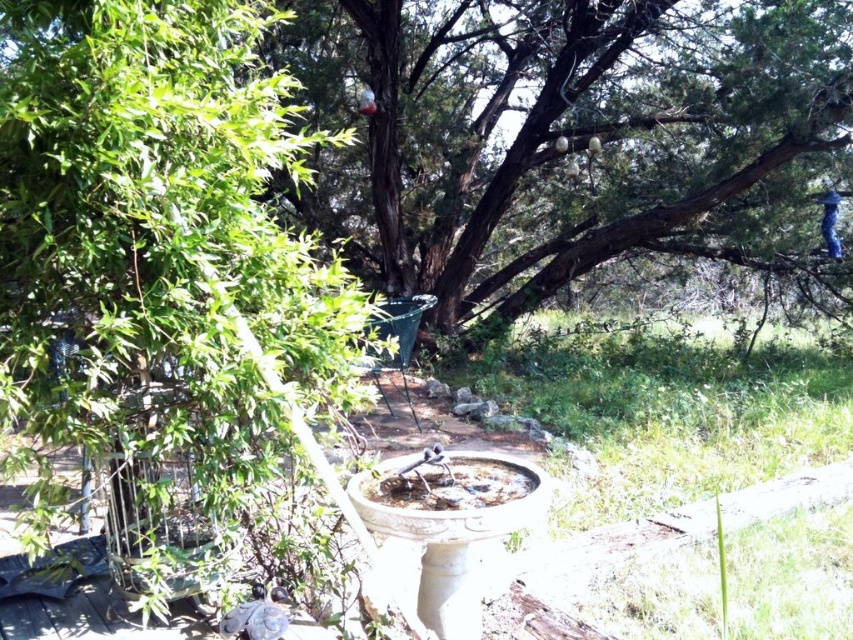
Between green leafy tree at upper left and white ceramic bird bath at center, which one appears on the right side from the viewer's perspective?

From the viewer's perspective, white ceramic bird bath at center appears more on the right side.

Who is higher up, green leafy tree at upper left or white ceramic bird bath at center?

Positioned higher is green leafy tree at upper left.

Between point (105, 35) and point (433, 541), which one is positioned behind?

Point (433, 541)

This screenshot has height=640, width=853. Identify the location of green leafy tree at upper left. (160, 237).

Can you confirm if blue matte parrot at upper right is positioned to the right of red matte bird at upper center?

Correct, you'll find blue matte parrot at upper right to the right of red matte bird at upper center.

Can you confirm if blue matte parrot at upper right is smaller than red matte bird at upper center?

No.

Is point (833, 248) positioned after point (372, 93)?

That is True.

The image size is (853, 640). Identify the location of blue matte parrot at upper right. (830, 221).

Which is in front, point (456, 3) or point (222, 621)?

Point (222, 621) is in front.

Locate an element on the screen. The image size is (853, 640). green textured tree at center is located at coordinates (567, 141).